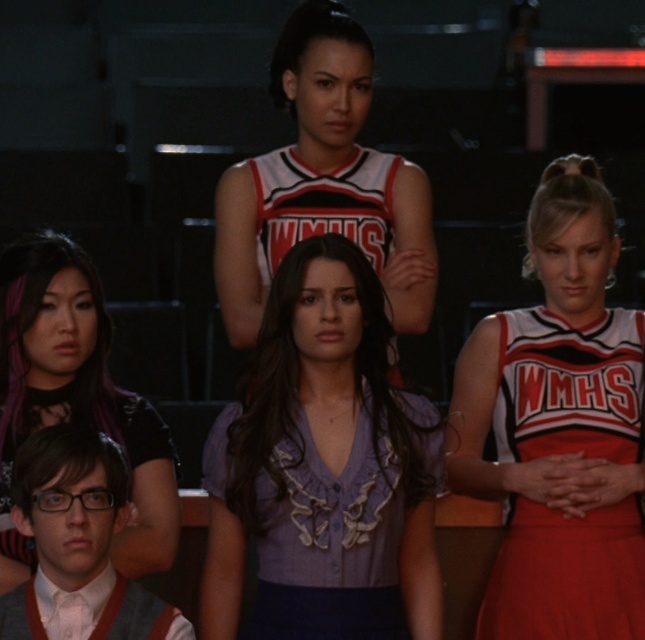
Question: Which point is farther to the camera?

Choices:
 (A) (511, 330)
 (B) (37, 416)
 (C) (68, 621)

Answer: (A)

Question: Observing the image, what is the correct spatial positioning of white jersey at center in reference to shiny purple hair at lower left?

Choices:
 (A) left
 (B) right

Answer: (B)

Question: Which object is closer to the camera taking this photo?

Choices:
 (A) sweater vest at lower left
 (B) purple satin blouse at center
 (C) shiny purple hair at lower left
 (D) white jersey at center

Answer: (A)

Question: Does shiny purple hair at lower left appear on the right side of sweater vest at lower left?

Choices:
 (A) yes
 (B) no

Answer: (B)

Question: Does purple satin blouse at center appear under white jersey at center?

Choices:
 (A) yes
 (B) no

Answer: (A)

Question: Based on their relative distances, which object is nearer to the shiny purple hair at lower left?

Choices:
 (A) red fabric cheerleader uniform at center
 (B) white jersey at center
 (C) purple satin blouse at center
 (D) sweater vest at lower left

Answer: (D)